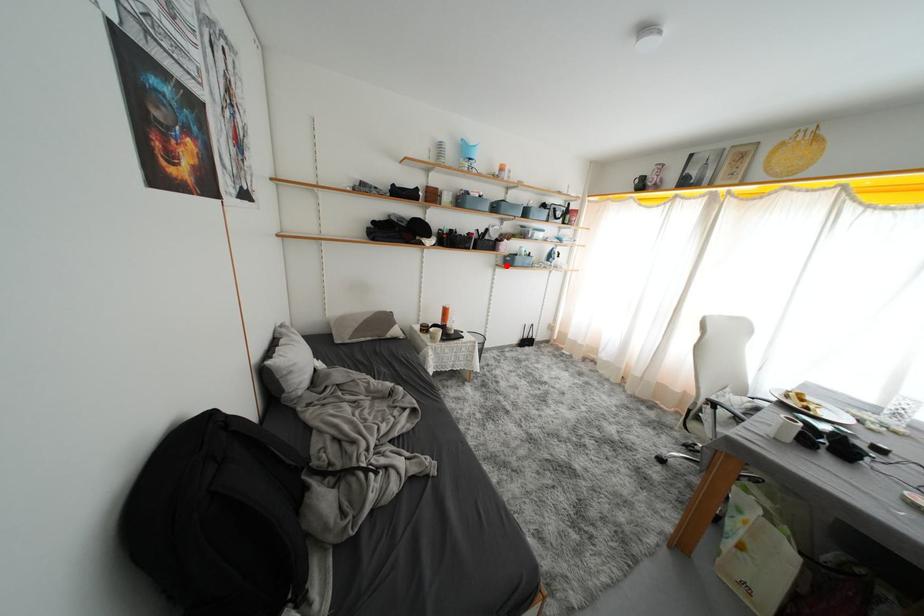
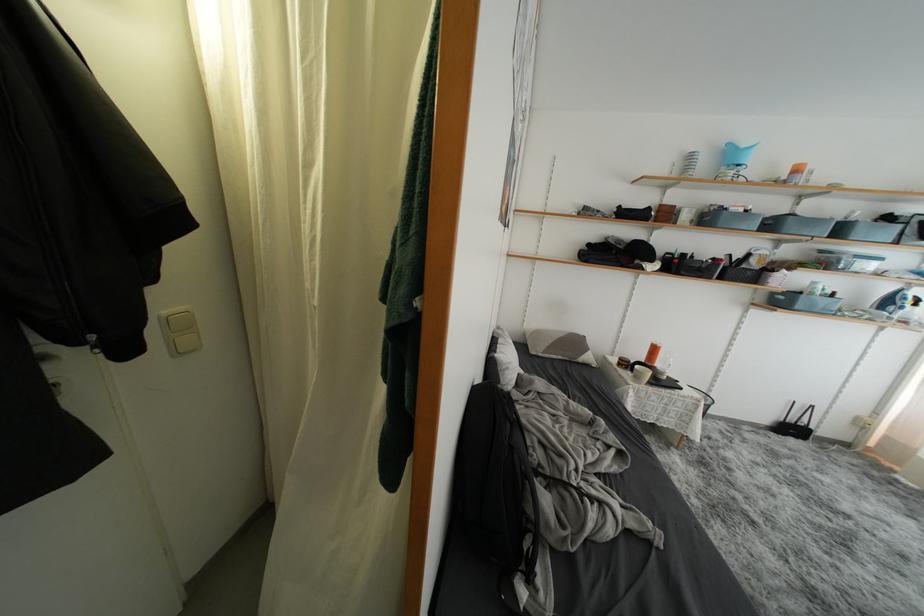
Question: I am providing you with two images of the same scene from different viewpoints. In image1, a red point is highlighted. Considering the same 3D point in image2, which of the following is correct?

Choices:
 (A) It is closer
 (B) It is farther

Answer: (B)